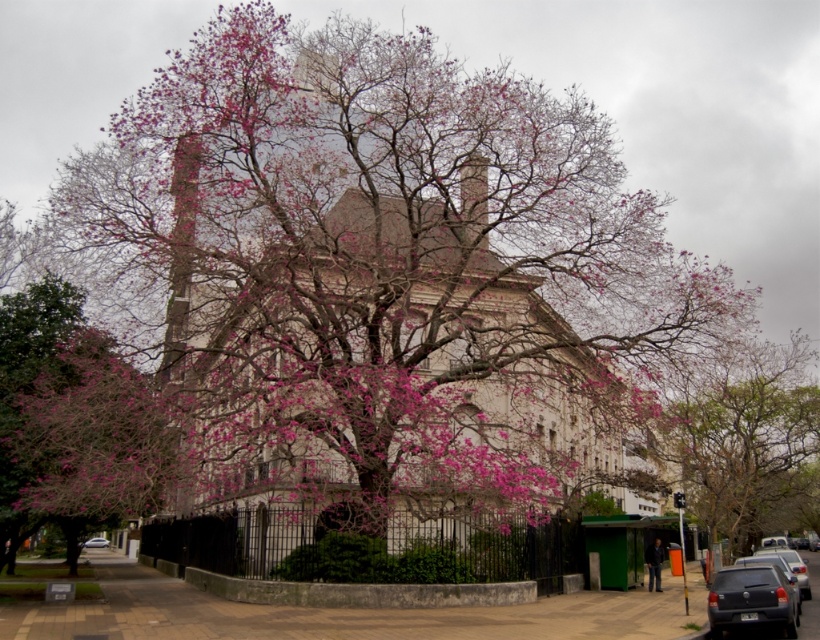
Can you confirm if matte gray sedan at lower right is taller than white glossy car at center?

Incorrect, matte gray sedan at lower right's height is not larger of white glossy car at center's.

Is matte gray sedan at lower right wider than white glossy car at center?

No, matte gray sedan at lower right is not wider than white glossy car at center.

Which is behind, point (768, 564) or point (106, 544)?

Positioned behind is point (106, 544).

This screenshot has height=640, width=820. Identify the location of matte gray sedan at lower right. (750, 600).

Is smooth beige church at center thinner than white glossy car at center?

→ No.

Can you confirm if smooth beige church at center is positioned to the left of white glossy car at center?

In fact, smooth beige church at center is to the right of white glossy car at center.

Who is more distant from viewer, (495, 476) or (103, 540)?

The point (103, 540) is behind.

Locate an element on the screen. smooth beige church at center is located at coordinates (404, 269).

Is matte gray sedan at lower right shorter than metallic gray sedan at lower right?

Yes.

Does matte gray sedan at lower right have a greater width compared to metallic gray sedan at lower right?

Incorrect, matte gray sedan at lower right's width does not surpass metallic gray sedan at lower right's.

What are the coordinates of `matte gray sedan at lower right` in the screenshot? It's located at (750, 600).